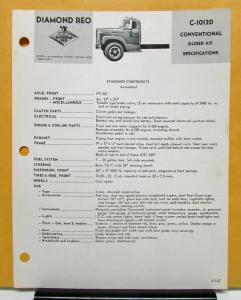
The image size is (241, 300). In order to click on window in this screenshot , I will do `click(134, 25)`.